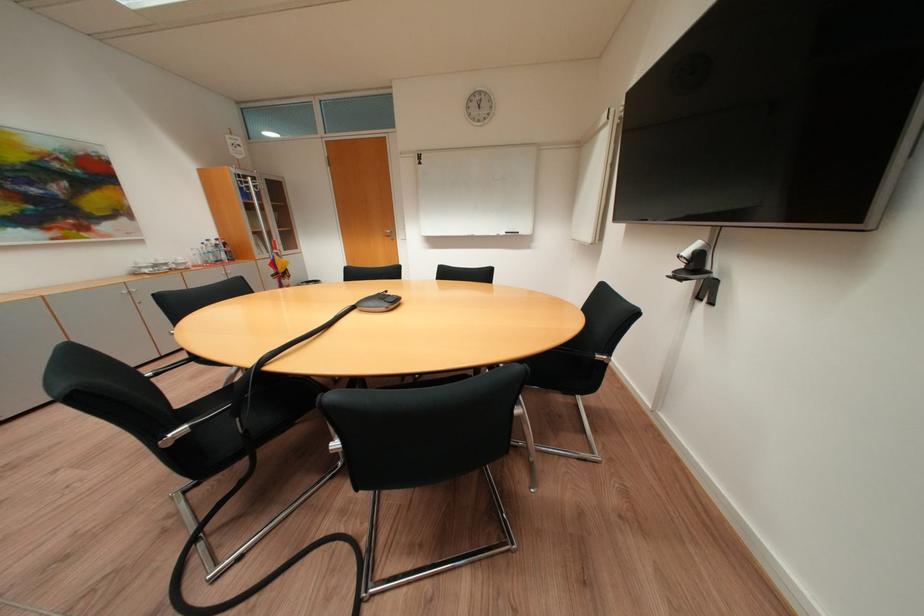
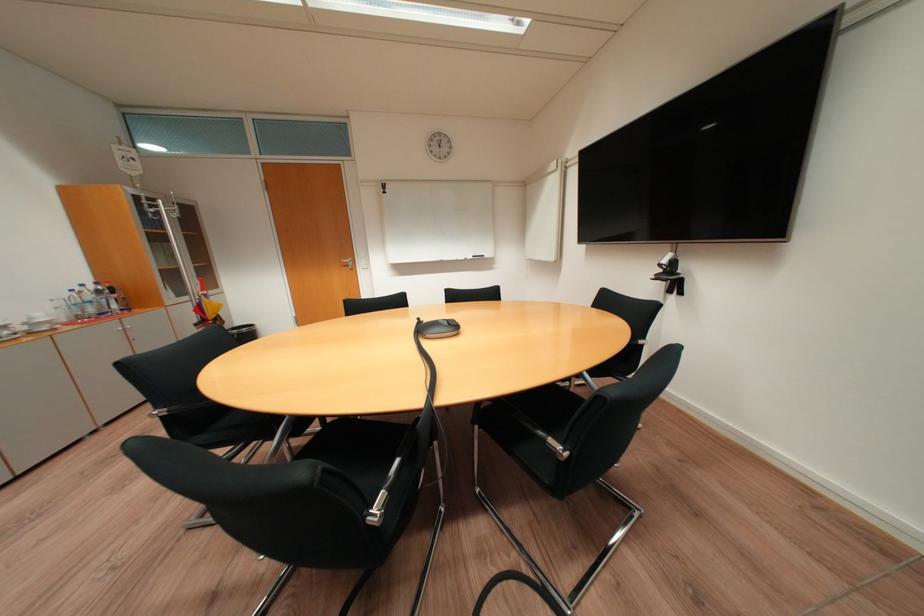
The point at (696,254) is marked in the first image. Where is the corresponding point in the second image?

(673, 262)